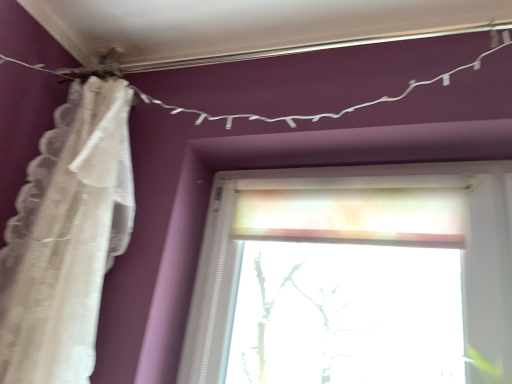
Question: Is white lace curtain at left turned away from white string lights at upper center?

Choices:
 (A) no
 (B) yes

Answer: (A)

Question: Does white lace curtain at left have a larger size compared to white string lights at upper center?

Choices:
 (A) yes
 (B) no

Answer: (A)

Question: From the image's perspective, is white lace curtain at left over white string lights at upper center?

Choices:
 (A) no
 (B) yes

Answer: (A)

Question: Considering the relative sizes of white lace curtain at left and white string lights at upper center in the image provided, is white lace curtain at left shorter than white string lights at upper center?

Choices:
 (A) no
 (B) yes

Answer: (A)

Question: From a real-world perspective, is white lace curtain at left on top of white string lights at upper center?

Choices:
 (A) no
 (B) yes

Answer: (A)

Question: Is white lace curtain at left completely or partially outside of white string lights at upper center?

Choices:
 (A) yes
 (B) no

Answer: (A)

Question: Is white string lights at upper center taller than white lace curtain at left?

Choices:
 (A) yes
 (B) no

Answer: (B)

Question: Is white string lights at upper center at the right side of white lace curtain at left?

Choices:
 (A) no
 (B) yes

Answer: (B)

Question: Considering the relative sizes of white string lights at upper center and white lace curtain at left in the image provided, is white string lights at upper center wider than white lace curtain at left?

Choices:
 (A) no
 (B) yes

Answer: (A)

Question: From a real-world perspective, is white string lights at upper center located beneath white lace curtain at left?

Choices:
 (A) yes
 (B) no

Answer: (B)

Question: From the image's perspective, would you say white string lights at upper center is positioned over white lace curtain at left?

Choices:
 (A) no
 (B) yes

Answer: (B)

Question: Does white string lights at upper center have a lesser width compared to white lace curtain at left?

Choices:
 (A) yes
 (B) no

Answer: (A)

Question: Which is correct: white string lights at upper center is inside white lace curtain at left, or outside of it?

Choices:
 (A) inside
 (B) outside

Answer: (B)